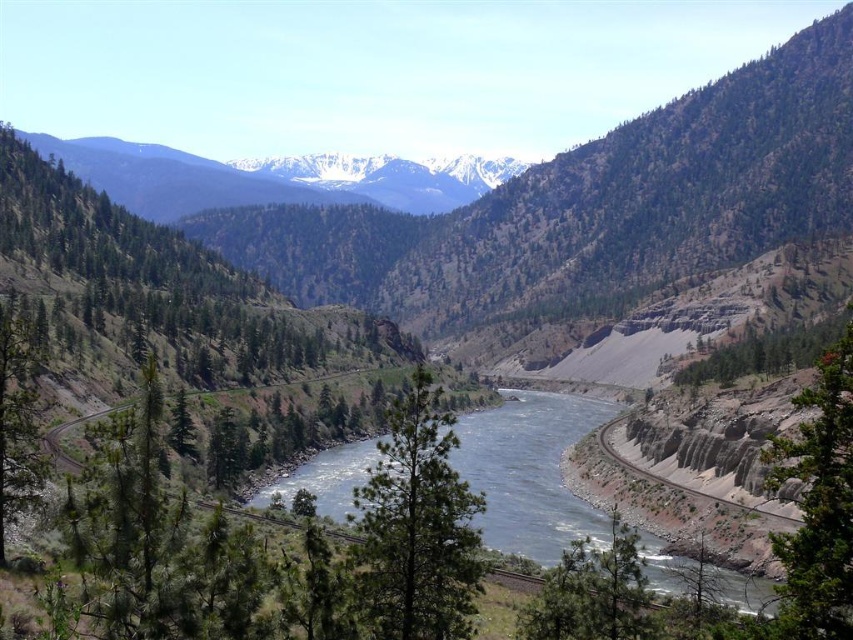
Question: Among these objects, which one is farthest from the camera?

Choices:
 (A) green textured tree at left
 (B) green textured rock at right

Answer: (A)

Question: Can you confirm if snowy white mountain range at upper center is positioned below green rough bark tree at right?

Choices:
 (A) no
 (B) yes

Answer: (A)

Question: Can you confirm if blue-green water at center is positioned above green textured rock at right?

Choices:
 (A) no
 (B) yes

Answer: (A)

Question: Which point is closer to the camera?

Choices:
 (A) green matte tree at center
 (B) green textured tree at left

Answer: (A)

Question: Does blue-green water at center appear on the right side of snowy white mountain range at upper center?

Choices:
 (A) yes
 (B) no

Answer: (A)

Question: Based on their relative distances, which object is farther from the blue-green water at center?

Choices:
 (A) green textured tree at left
 (B) green matte tree at center
 (C) snowy white mountain range at upper center
 (D) green textured rock at right

Answer: (C)